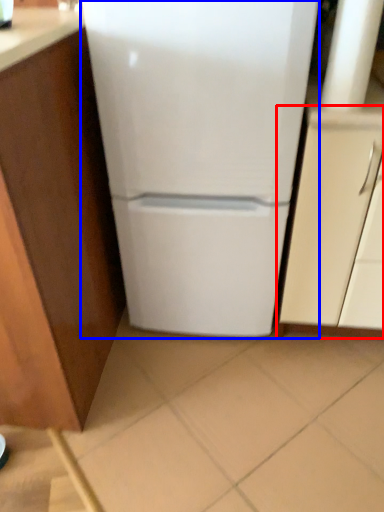
Question: Which of the following is the closest to the observer, cabinetry (highlighted by a red box) or refrigerator (highlighted by a blue box)?

Choices:
 (A) cabinetry
 (B) refrigerator

Answer: (B)